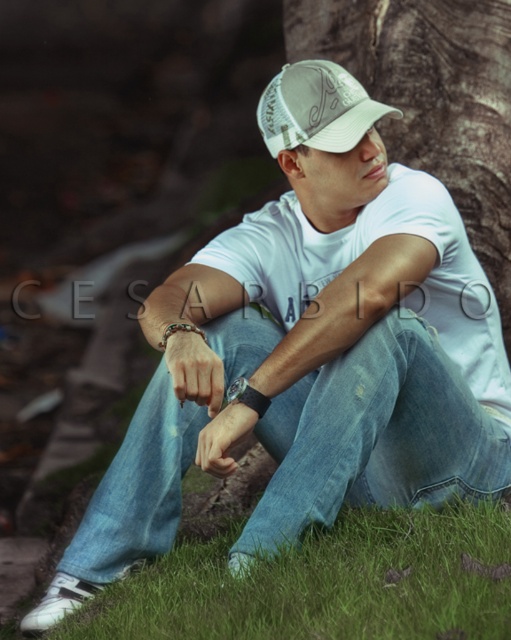
You are a photographer adjusting your camera to focus on two points in the scene. The first point is at coordinates point (367, 234) and the second point is at point (257, 419). Which point should you focus on first if you want to ensure both points are in focus, considering their depth relative to the viewer?

You should focus on point (367, 234) first because it is closer to the viewer than point (257, 419). This ensures that the closer point is in focus, and the farther point may also be within the depth of field.

Looking at the person in the image, which bracelet is positioned to the right when comparing the black leather bracelet at lower center and the multicolored beaded bracelet at wrist?

The black leather bracelet at lower center is positioned to the right of the multicolored beaded bracelet at wrist.